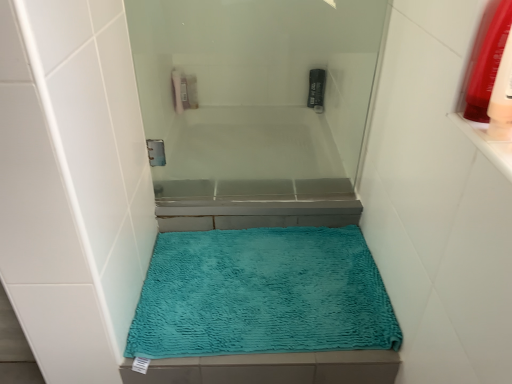
The width and height of the screenshot is (512, 384). Find the location of `vacant space underneath transparent glass screen door at upper center (from a real-world perspective)`. vacant space underneath transparent glass screen door at upper center (from a real-world perspective) is located at coordinates (254, 195).